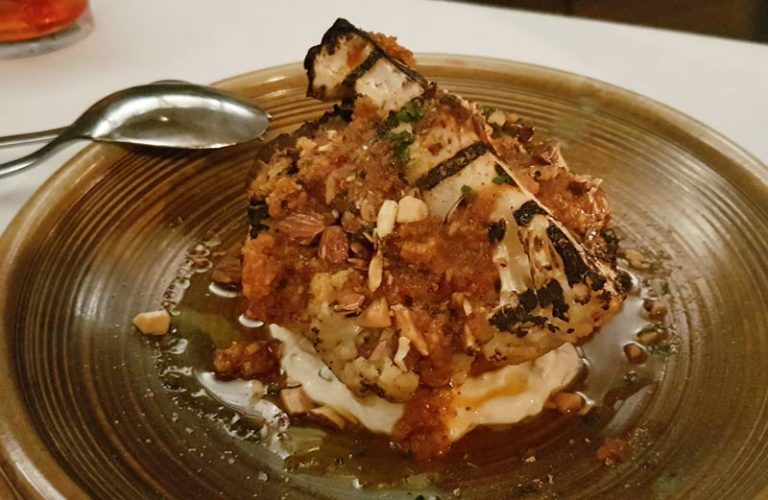
I want to click on edge of plate, so click(682, 124).